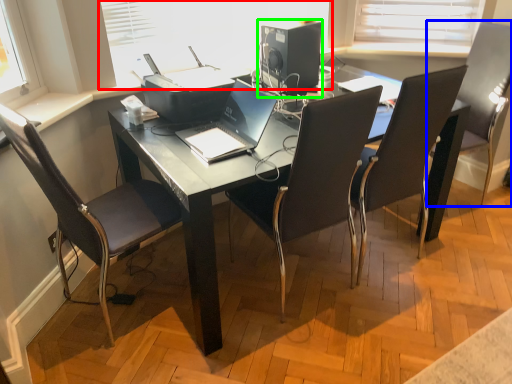
Question: Estimate the real-world distances between objects in this image. Which object is closer to window screen (highlighted by a red box), chair (highlighted by a blue box) or desktop computer (highlighted by a green box)?

Choices:
 (A) chair
 (B) desktop computer

Answer: (B)